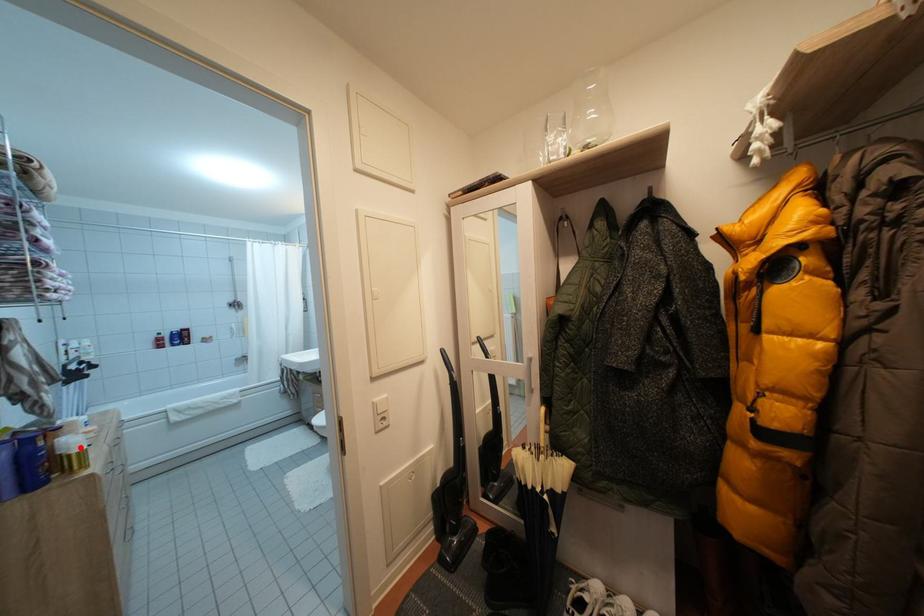
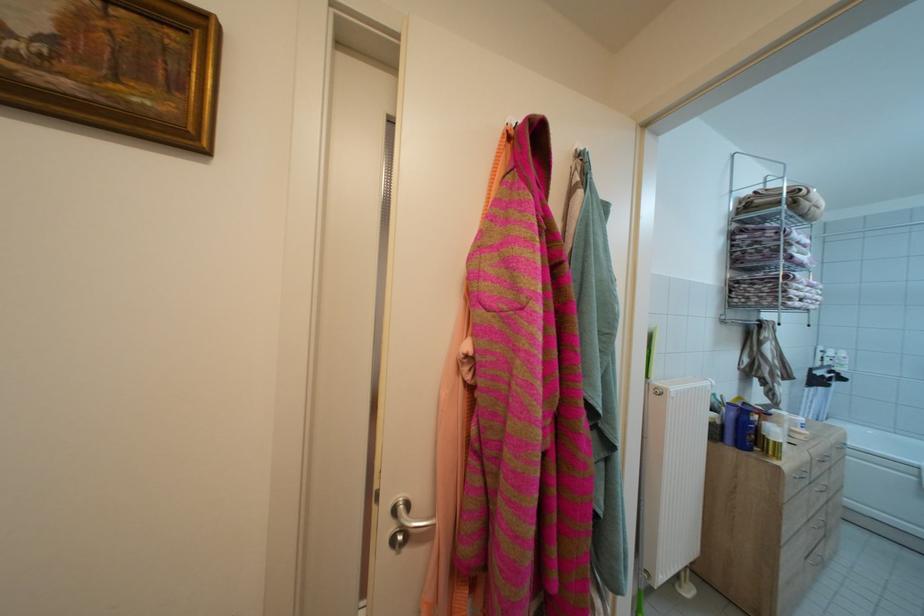
Question: I am providing you with two images of the same scene from different viewpoints. In image1, a red point is highlighted. Considering the same 3D point in image2, which of the following is correct?

Choices:
 (A) It is closer
 (B) It is farther

Answer: (A)